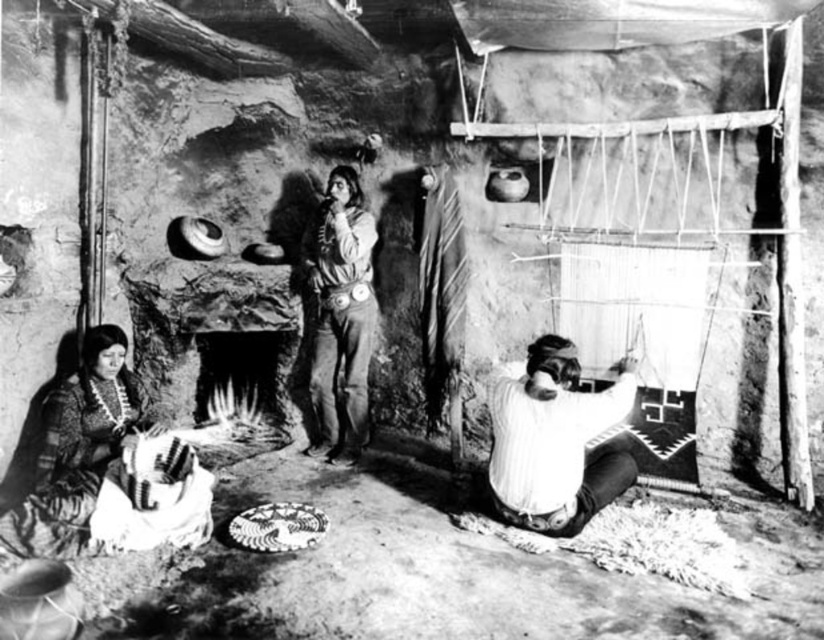
In the scene shown: Who is positioned more to the left, smooth stone fireplace at center left or smooth leather jacket at center?

From the viewer's perspective, smooth stone fireplace at center left appears more on the left side.

How distant is smooth stone fireplace at center left from smooth leather jacket at center?

The distance of smooth stone fireplace at center left from smooth leather jacket at center is 23.41 inches.

Is point (204, 342) farther from camera compared to point (310, 376)?

Yes, it is.

This screenshot has height=640, width=824. Identify the location of smooth stone fireplace at center left. (216, 332).

Between white striped shirt at lower right and smooth leather jacket at center, which one is positioned higher?

smooth leather jacket at center

Is white striped shirt at lower right shorter than smooth leather jacket at center?

Yes, white striped shirt at lower right is shorter than smooth leather jacket at center.

Describe the element at coordinates (555, 440) in the screenshot. I see `white striped shirt at lower right` at that location.

At what (x,y) coordinates should I click in order to perform the action: click on white striped shirt at lower right. Please return your answer as a coordinate pair (x, y). Looking at the image, I should click on (555, 440).

Can you confirm if smooth stone fireplace at center left is bigger than white striped shirt at lower right?

Yes.

Is smooth stone fireplace at center left shorter than white striped shirt at lower right?

No.

Which is in front, point (165, 376) or point (517, 413)?

Point (517, 413) is in front.

Find the location of `smooth stone fireplace at center left`. smooth stone fireplace at center left is located at coordinates (216, 332).